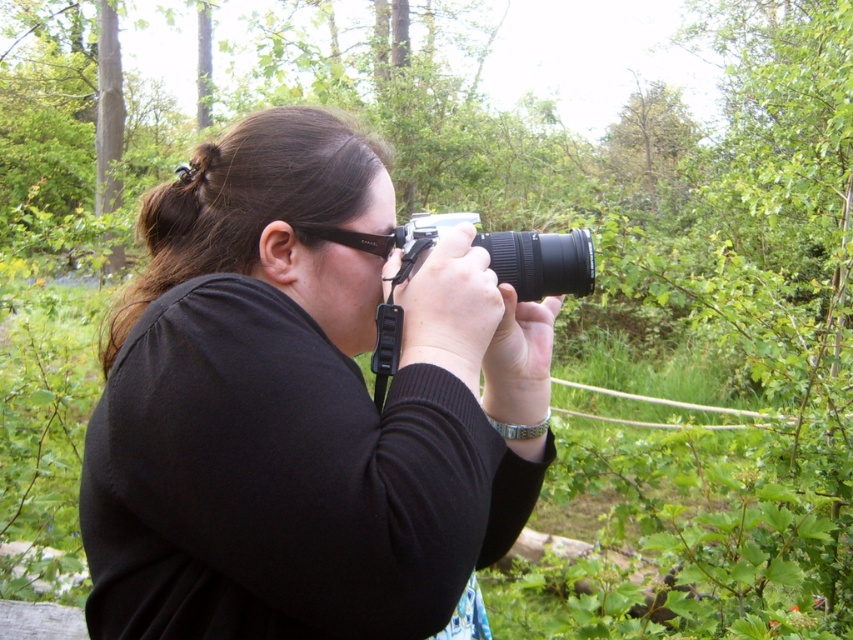
Does black plastic camera at center lie in front of black rubber glasses at center?

That is True.

Which of these two, black plastic camera at center or black rubber glasses at center, stands shorter?

black rubber glasses at center is shorter.

At what (x,y) coordinates should I click in order to perform the action: click on black plastic camera at center. Please return your answer as a coordinate pair (x, y). Image resolution: width=853 pixels, height=640 pixels. Looking at the image, I should click on (541, 260).

Who is more forward, (x=373, y=529) or (x=457, y=220)?

Point (x=373, y=529)

Is black matte camera at center thinner than black plastic camera at center?

No, black matte camera at center is not thinner than black plastic camera at center.

Is point (340, 280) in front of point (508, 230)?

That is True.

At what (x,y) coordinates should I click in order to perform the action: click on black matte camera at center. Please return your answer as a coordinate pair (x, y). Looking at the image, I should click on (300, 408).

Between black matte camera at center and black rubber glasses at center, which one has less height?

black rubber glasses at center

Is black matte camera at center shorter than black rubber glasses at center?

Incorrect, black matte camera at center's height does not fall short of black rubber glasses at center's.

Describe the element at coordinates (300, 408) in the screenshot. I see `black matte camera at center` at that location.

The image size is (853, 640). Identify the location of black matte camera at center. (300, 408).